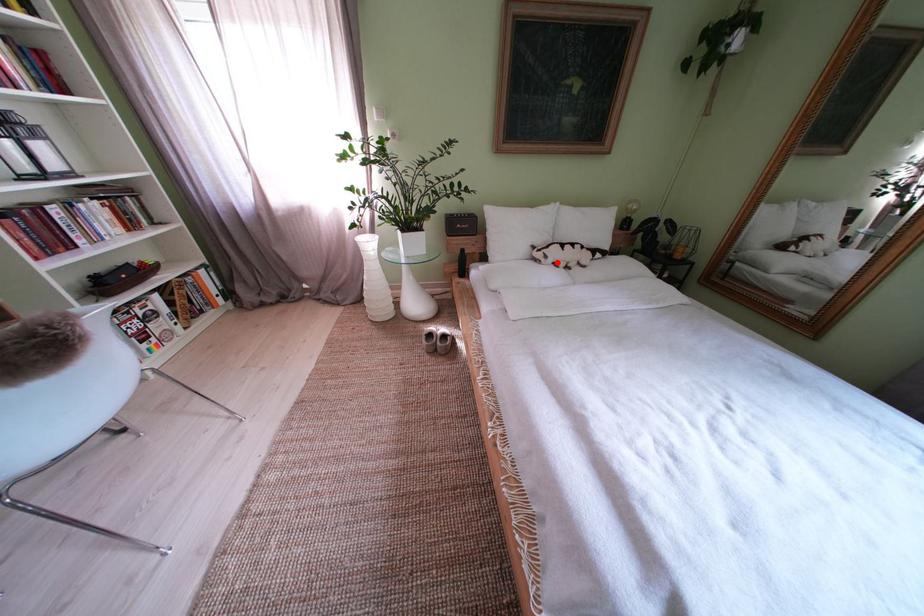
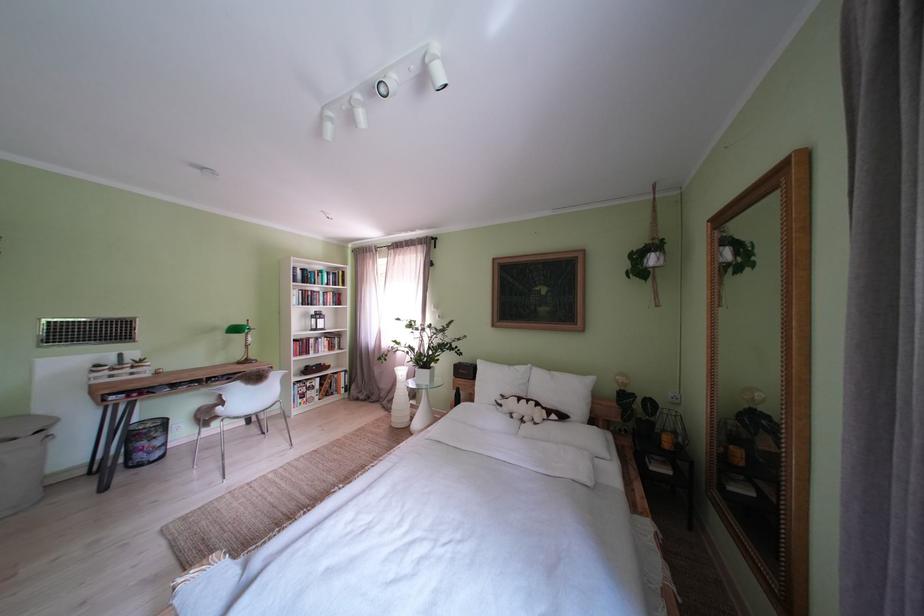
Locate, in the second image, the point that corresponds to the highlighted location in the first image.

(512, 411)